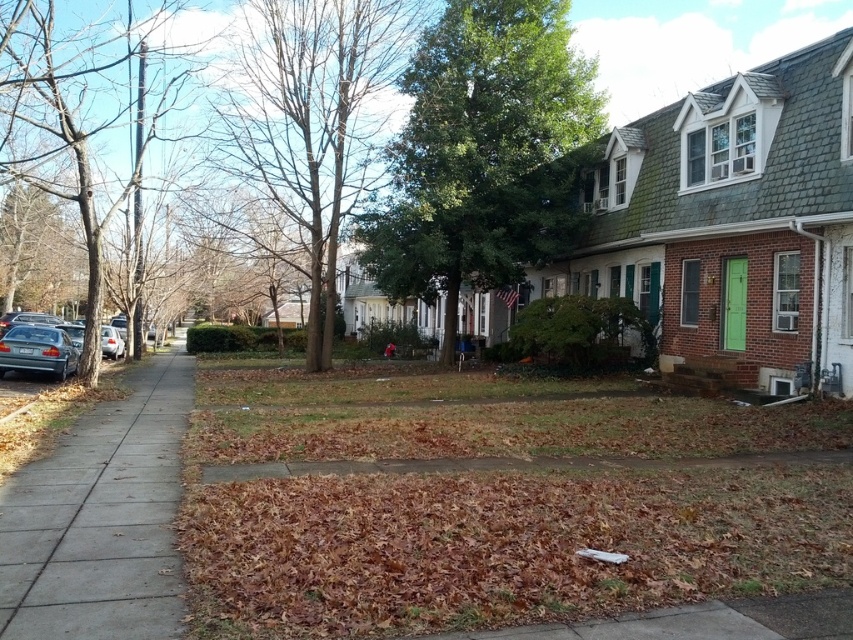
The width and height of the screenshot is (853, 640). I want to click on bare wood tree at center, so click(310, 125).

This screenshot has width=853, height=640. What do you see at coordinates (310, 125) in the screenshot? I see `bare wood tree at center` at bounding box center [310, 125].

Where is `bare wood tree at center`? The height and width of the screenshot is (640, 853). bare wood tree at center is located at coordinates (310, 125).

Which is in front, point (51, 332) or point (103, 340)?

Point (51, 332) is in front.

Identify the location of metallic blue sedan at left. (38, 349).

Is point (38, 336) less distant than point (113, 342)?

Yes.

What are the coordinates of `metallic blue sedan at left` in the screenshot? It's located at (38, 349).

Between point (525, 129) and point (111, 346), which one is positioned behind?

The point (111, 346) is behind.

Is green leafy tree at center thinner than matte silver sedan at left?

In fact, green leafy tree at center might be wider than matte silver sedan at left.

The image size is (853, 640). In order to click on green leafy tree at center in this screenshot , I will do `click(485, 154)`.

Identify the location of green leafy tree at center. This screenshot has height=640, width=853. (485, 154).